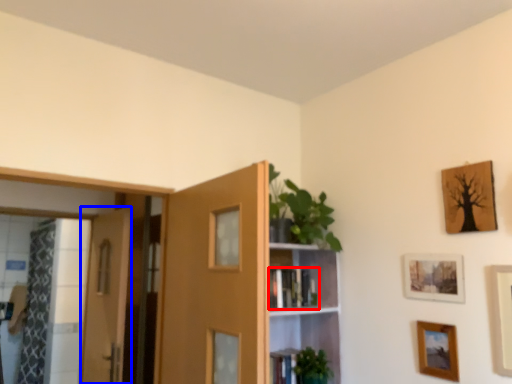
Question: Which point is further to the camera, book (highlighted by a red box) or door (highlighted by a blue box)?

Choices:
 (A) book
 (B) door

Answer: (B)